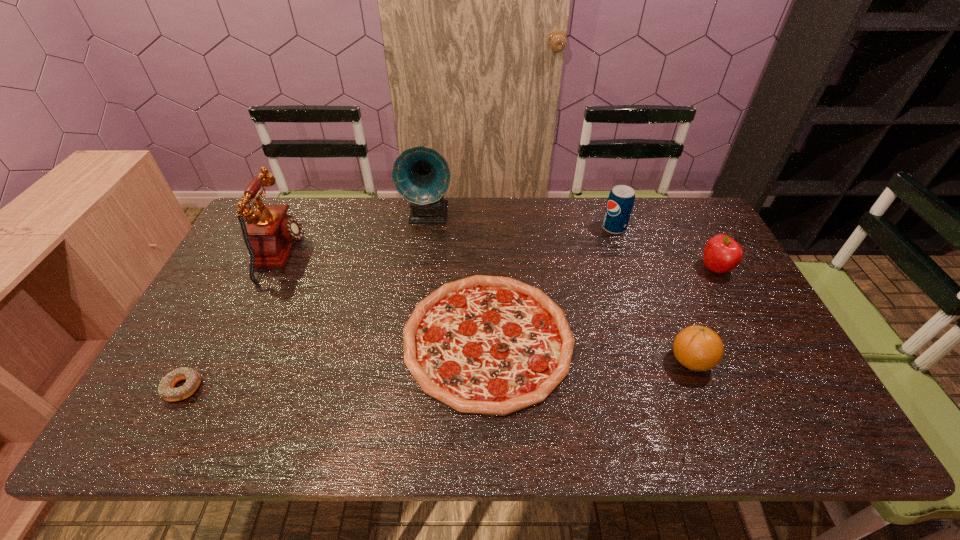
Locate an element on the screen. object present at the right edge is located at coordinates (722, 254).

Where is `object that is at the far left corner`? object that is at the far left corner is located at coordinates (271, 233).

At what (x,y) coordinates should I click in order to perform the action: click on free space at the far edge. Please return your answer as a coordinate pair (x, y). Image resolution: width=960 pixels, height=540 pixels. Looking at the image, I should click on tap(562, 200).

This screenshot has width=960, height=540. I want to click on vacant position at the near edge of the desktop, so 248,432.

The width and height of the screenshot is (960, 540). I want to click on free space at the left edge of the desktop, so click(235, 284).

Find the location of a particular element. free space at the right edge is located at coordinates (757, 404).

You are a GUI agent. You are given a task and a screenshot of the screen. Output one action in this format:
    pyautogui.click(x=<x>, y=<y>)
    Task: Click on the vacant space at the far left corner of the desktop
    
    Given the screenshot: What is the action you would take?
    pyautogui.click(x=300, y=214)

At what (x,y) coordinates should I click in order to perform the action: click on vacant space at the near left corner of the desktop. Please return your answer as a coordinate pair (x, y). Looking at the image, I should click on (144, 432).

Locate an element on the screen. This screenshot has width=960, height=540. free space at the near right corner of the desktop is located at coordinates (810, 410).

The height and width of the screenshot is (540, 960). I want to click on free spot between the pop and the second tallest object, so click(x=447, y=241).